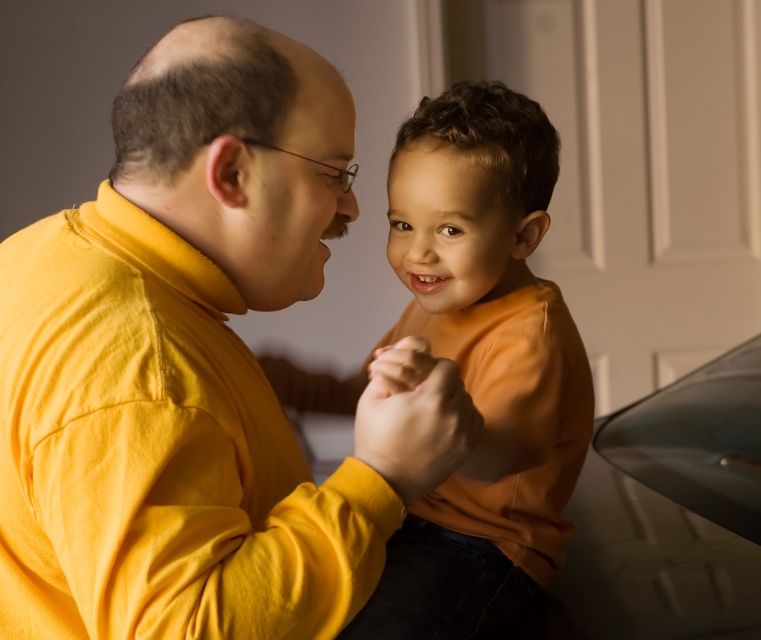
Is yellow matte shirt at center behind orange matte shirt at center?

No, it is in front of orange matte shirt at center.

Which is above, yellow matte shirt at center or orange matte shirt at center?

yellow matte shirt at center is higher up.

Measure the distance between yellow matte shirt at center and camera.

yellow matte shirt at center is 22.10 inches away from camera.

Image resolution: width=761 pixels, height=640 pixels. I want to click on yellow matte shirt at center, so click(196, 369).